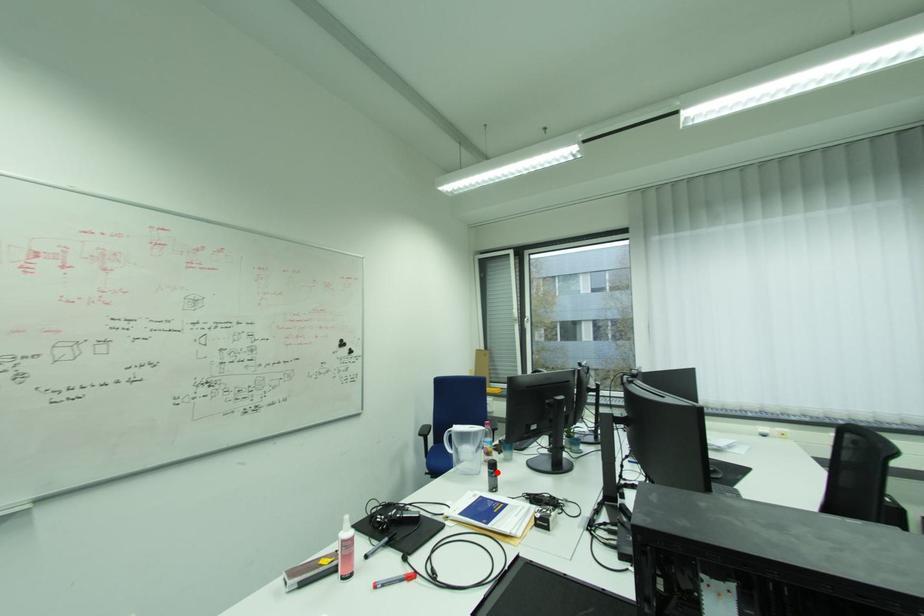
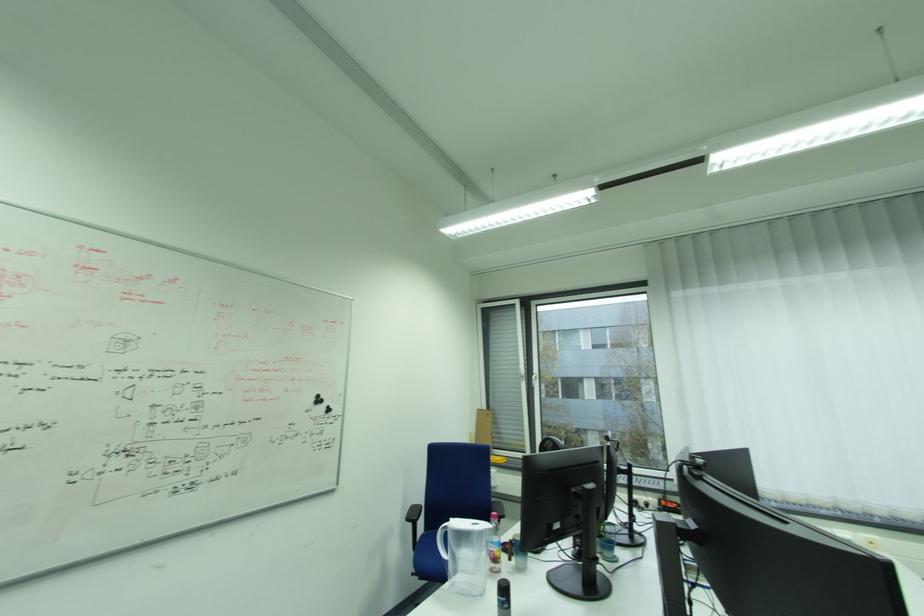
Where in the second image is the point corresponding to the highlighted location from the first image?

(505, 600)